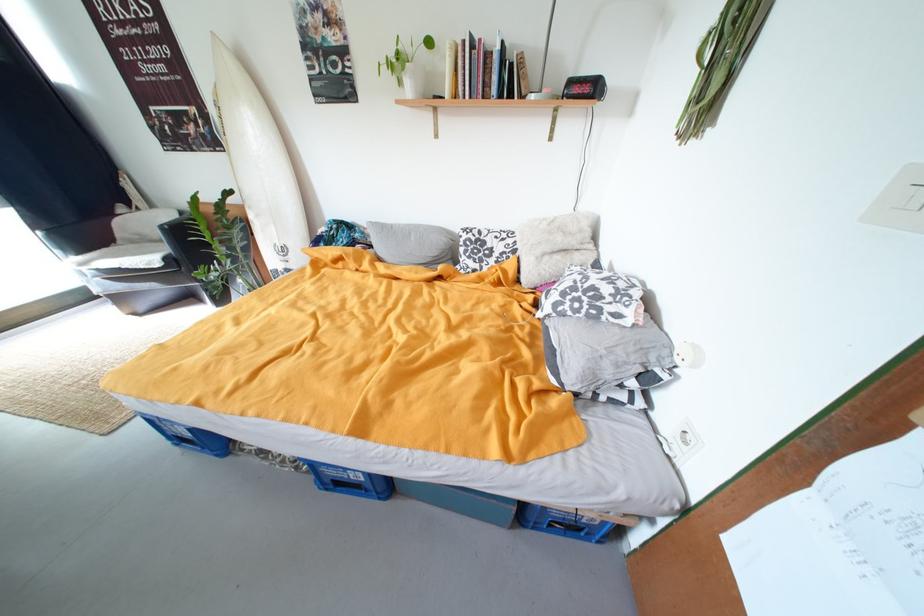
Image resolution: width=924 pixels, height=616 pixels. I want to click on gray pillow, so click(x=414, y=244).